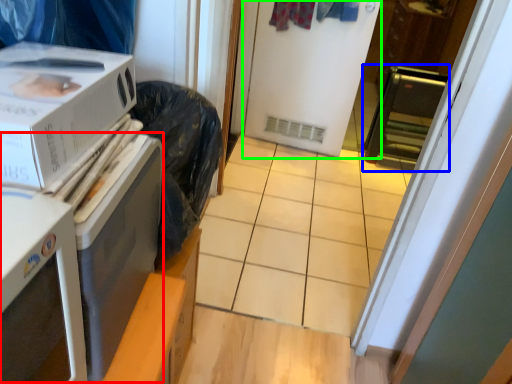
Question: Which object is positioned farthest from appliance (highlighted by a red box)? Select from appliance (highlighted by a blue box) and screen door (highlighted by a green box).

Choices:
 (A) appliance
 (B) screen door

Answer: (A)